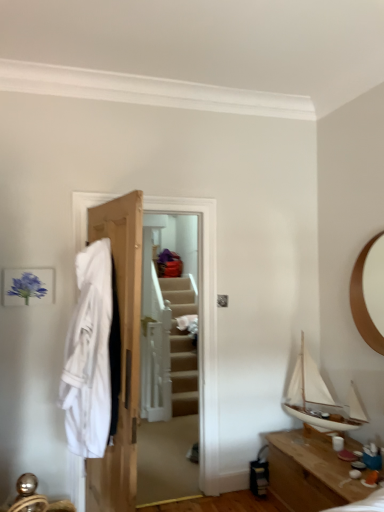
Question: Is white cotton robe at left shorter than wooden door at center?

Choices:
 (A) no
 (B) yes

Answer: (B)

Question: Can you confirm if white cotton robe at left is bigger than wooden door at center?

Choices:
 (A) yes
 (B) no

Answer: (B)

Question: Does white cotton robe at left have a lesser width compared to wooden door at center?

Choices:
 (A) no
 (B) yes

Answer: (A)

Question: From a real-world perspective, does white cotton robe at left stand above wooden door at center?

Choices:
 (A) yes
 (B) no

Answer: (B)

Question: Does white cotton robe at left come behind wooden door at center?

Choices:
 (A) no
 (B) yes

Answer: (A)

Question: Is point (104, 419) positioned closer to the camera than point (307, 400)?

Choices:
 (A) closer
 (B) farther

Answer: (A)

Question: Do you think white cotton robe at left is within white matte sailboat at right, or outside of it?

Choices:
 (A) outside
 (B) inside

Answer: (A)

Question: Is white cotton robe at left taller or shorter than white matte sailboat at right?

Choices:
 (A) short
 (B) tall

Answer: (B)

Question: Is white cotton robe at left wider or thinner than white matte sailboat at right?

Choices:
 (A) thin
 (B) wide

Answer: (A)

Question: From a real-world perspective, is white matte sailboat at right above or below white cotton robe at left?

Choices:
 (A) below
 (B) above

Answer: (A)

Question: Based on their sizes in the image, would you say white matte sailboat at right is bigger or smaller than white cotton robe at left?

Choices:
 (A) small
 (B) big

Answer: (A)

Question: Is white matte sailboat at right wider or thinner than white cotton robe at left?

Choices:
 (A) thin
 (B) wide

Answer: (B)

Question: Considering the positions of point (284, 404) and point (79, 371), is point (284, 404) closer or farther from the camera than point (79, 371)?

Choices:
 (A) farther
 (B) closer

Answer: (A)

Question: Based on their sizes in the image, would you say wooden table at lower right is bigger or smaller than white matte sailboat at right?

Choices:
 (A) small
 (B) big

Answer: (B)

Question: From the image's perspective, is wooden table at lower right located above or below white matte sailboat at right?

Choices:
 (A) above
 (B) below

Answer: (B)